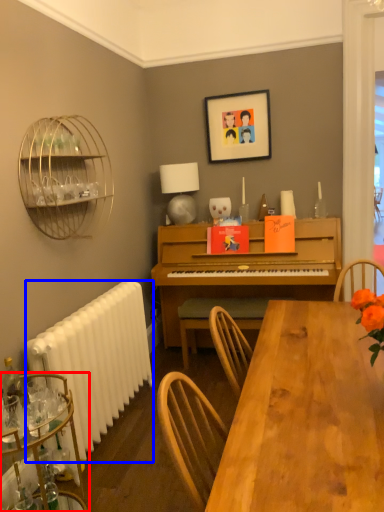
Question: Among these objects, which one is nearest to the camera, desk (highlighted by a red box) or radiator (highlighted by a blue box)?

Choices:
 (A) desk
 (B) radiator

Answer: (A)